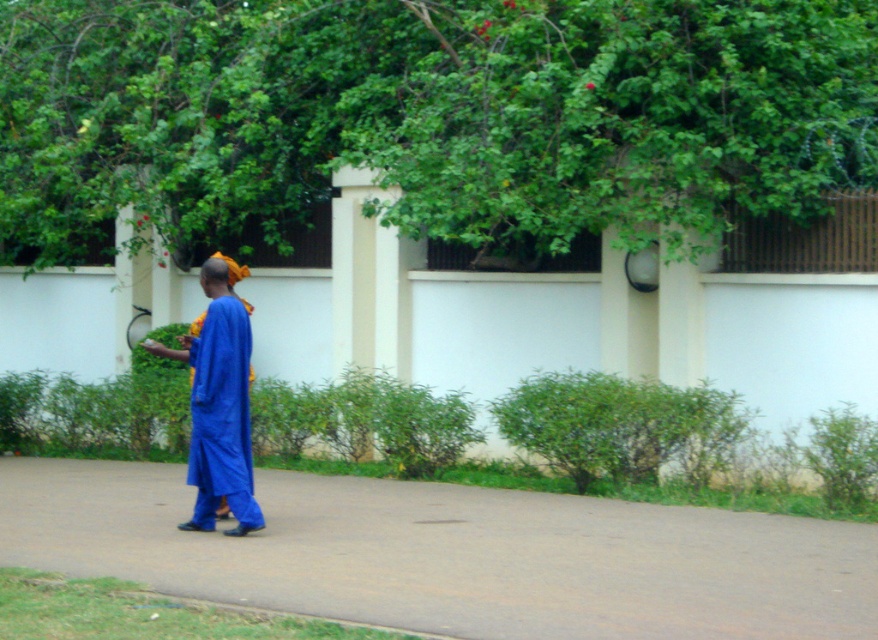
Question: Among these points, which one is farthest from the camera?

Choices:
 (A) (88, 180)
 (B) (245, 426)

Answer: (A)

Question: Is green leafy tree at upper center smaller than blue cotton robe at center?

Choices:
 (A) no
 (B) yes

Answer: (B)

Question: Is the position of smooth concrete pavement at center more distant than that of blue cotton robe at center?

Choices:
 (A) yes
 (B) no

Answer: (B)

Question: Based on their relative distances, which object is nearer to the smooth concrete pavement at center?

Choices:
 (A) blue cotton robe at center
 (B) green leafy tree at upper center

Answer: (A)

Question: Among these points, which one is nearest to the camera?

Choices:
 (A) (241, 342)
 (B) (148, 579)

Answer: (B)

Question: Observing the image, what is the correct spatial positioning of smooth concrete pavement at center in reference to blue cotton robe at center?

Choices:
 (A) right
 (B) left

Answer: (A)